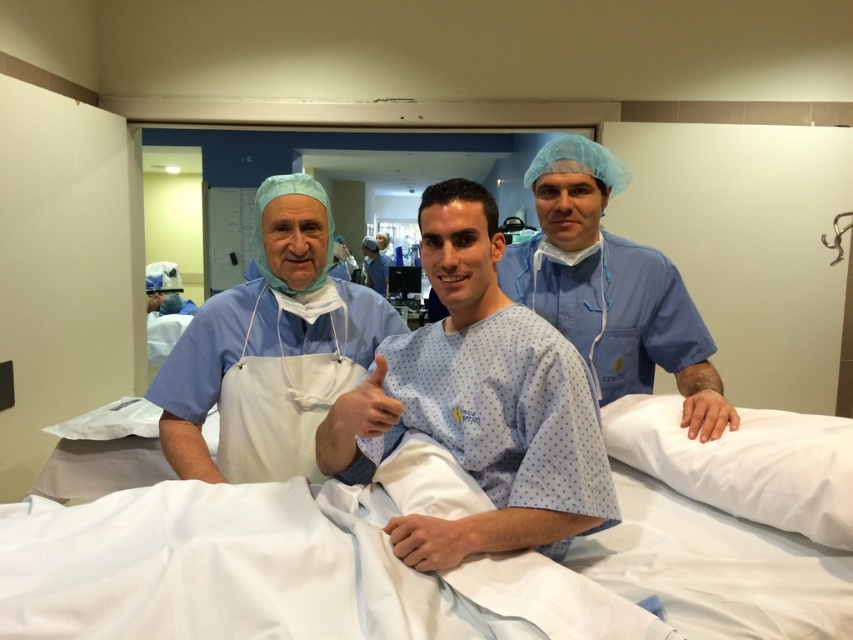
Based on the photo, is blue fabric hospital gown at center bigger than blue smooth scrubs at right?

No, blue fabric hospital gown at center is not bigger than blue smooth scrubs at right.

Identify the location of blue fabric hospital gown at center. (486, 401).

Is blue smooth scrubs at right to the right of blue surgical gown at center from the viewer's perspective?

Indeed, blue smooth scrubs at right is positioned on the right side of blue surgical gown at center.

How distant is blue smooth scrubs at right from blue surgical gown at center?

blue smooth scrubs at right and blue surgical gown at center are 5.40 meters apart.

Where is `blue smooth scrubs at right`? The height and width of the screenshot is (640, 853). blue smooth scrubs at right is located at coordinates (610, 288).

The width and height of the screenshot is (853, 640). What do you see at coordinates (486, 401) in the screenshot? I see `blue fabric hospital gown at center` at bounding box center [486, 401].

Identify the location of blue fabric hospital gown at center. This screenshot has height=640, width=853. (486, 401).